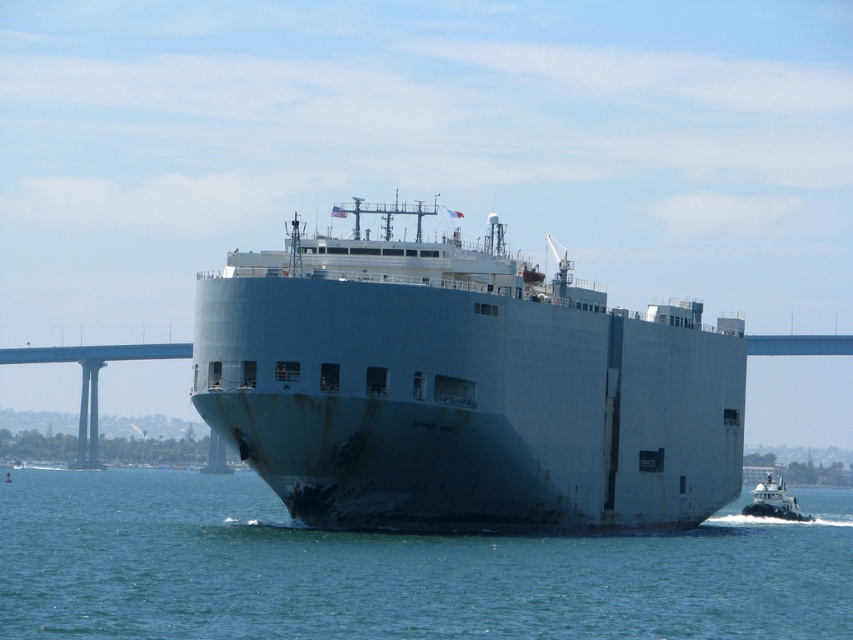
You are a photographer standing on a pier and want to capture the gray matte cargo ship at center in your photo. The camera you are using has a maximum focus range of 80 meters. Will the ship be in focus?

The gray matte cargo ship at center is 85.70 meters from camera, which exceeds the camera maximum focus range of 80 meters. The ship will not be in focus.